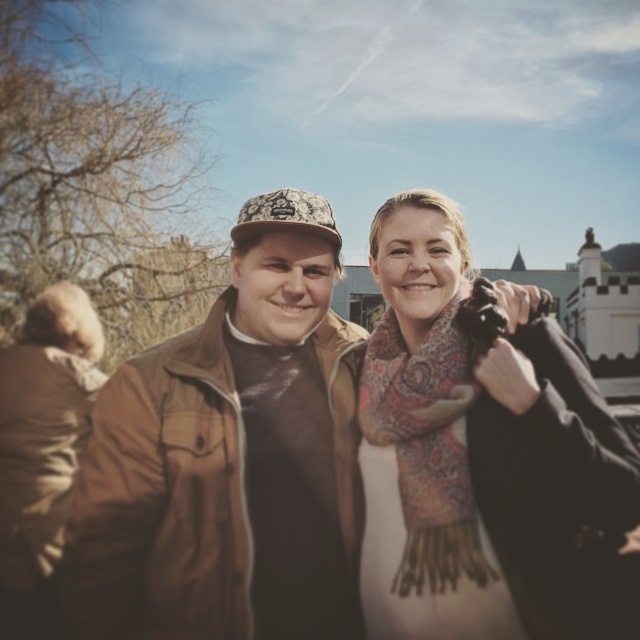
Is patterned scarf at center thinner than patterned wool scarf at center?

Incorrect, patterned scarf at center's width is not less than patterned wool scarf at center's.

Who is more forward, (x=388, y=259) or (x=467, y=577)?

Point (x=467, y=577)

Between point (540, 330) and point (504, 321), which one is positioned behind?

The point (540, 330) is more distant.

The height and width of the screenshot is (640, 640). I want to click on patterned scarf at center, so click(x=483, y=456).

Does point (280, 483) come farther from viewer compared to point (452, 326)?

That is False.

In the scene shown: Does brown leather jacket at center appear on the right side of patterned wool scarf at center?

In fact, brown leather jacket at center is to the left of patterned wool scarf at center.

Locate an element on the screen. brown leather jacket at center is located at coordinates (228, 458).

Is brown leather jacket at center smaller than patterned scarf at center?

Actually, brown leather jacket at center might be larger than patterned scarf at center.

Who is higher up, brown leather jacket at center or patterned scarf at center?

Positioned higher is patterned scarf at center.

You are a GUI agent. You are given a task and a screenshot of the screen. Output one action in this format:
    pyautogui.click(x=<x>, y=<y>)
    Task: Click on the brown leather jacket at center
    Image resolution: width=640 pixels, height=640 pixels.
    Given the screenshot: What is the action you would take?
    (228, 458)